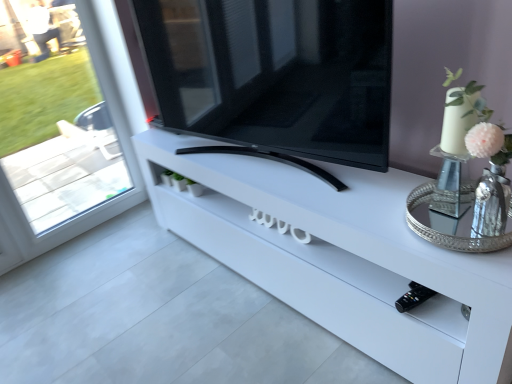
Question: Do you think black glossy tv at center is within white glossy tv stand at center, or outside of it?

Choices:
 (A) outside
 (B) inside

Answer: (A)

Question: From the image's perspective, is black glossy tv at center above or below white glossy tv stand at center?

Choices:
 (A) above
 (B) below

Answer: (A)

Question: Estimate the real-world distances between objects in this image. Which object is farther from the silver metallic tray at right?

Choices:
 (A) black glossy tv at center
 (B) white glossy tv stand at center
 (C) transparent glass window at left

Answer: (C)

Question: Estimate the real-world distances between objects in this image. Which object is closer to the transparent glass window at left?

Choices:
 (A) black glossy tv at center
 (B) silver metallic tray at right
 (C) white glossy tv stand at center

Answer: (A)